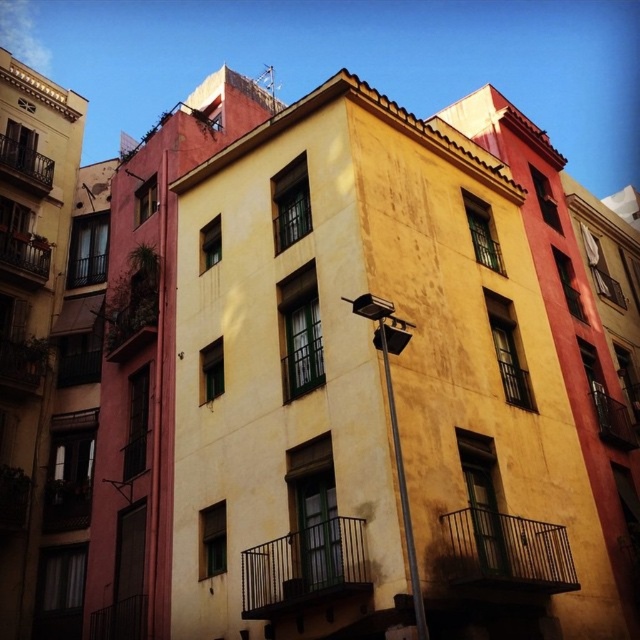
Question: Can you confirm if metallic pole at center is smaller than rustic metal balcony at left?

Choices:
 (A) no
 (B) yes

Answer: (A)

Question: Estimate the real-world distances between objects in this image. Which object is farther from the metallic pole at center?

Choices:
 (A) green metal balcony at center
 (B) metallic black balcony at right
 (C) metallic black balcony at lower right
 (D) rustic wood balcony at left

Answer: (D)

Question: Is metallic black balcony at lower right to the right of metallic pole at center from the viewer's perspective?

Choices:
 (A) no
 (B) yes

Answer: (B)

Question: Does green metal balcony at center appear on the right side of metallic pole at center?

Choices:
 (A) no
 (B) yes

Answer: (A)

Question: Which of the following is the farthest from the observer?

Choices:
 (A) (380, 300)
 (B) (22, 275)
 (C) (36, 186)

Answer: (C)

Question: Which object appears farthest from the camera in this image?

Choices:
 (A) metallic pole at center
 (B) metallic black balcony at lower right
 (C) rustic metal balcony at left

Answer: (C)